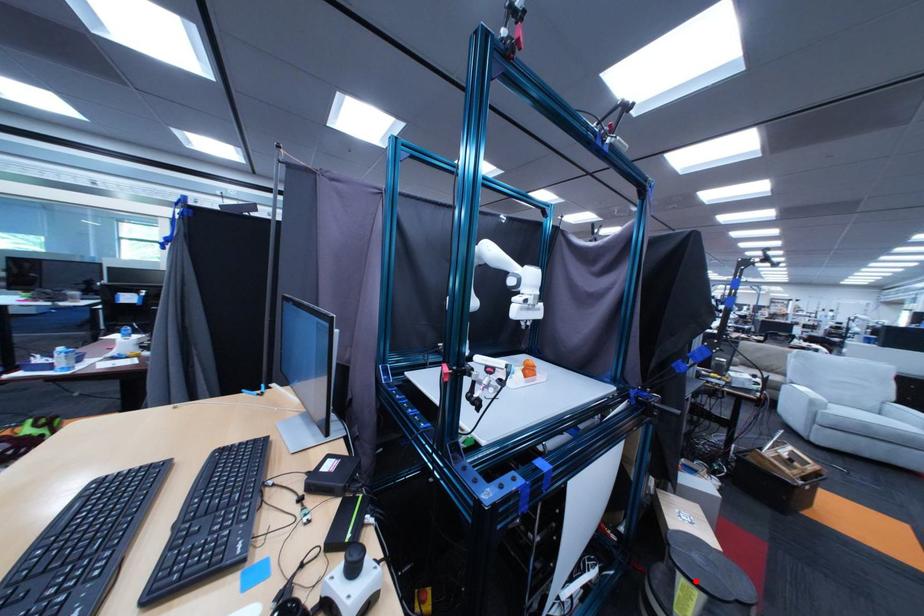
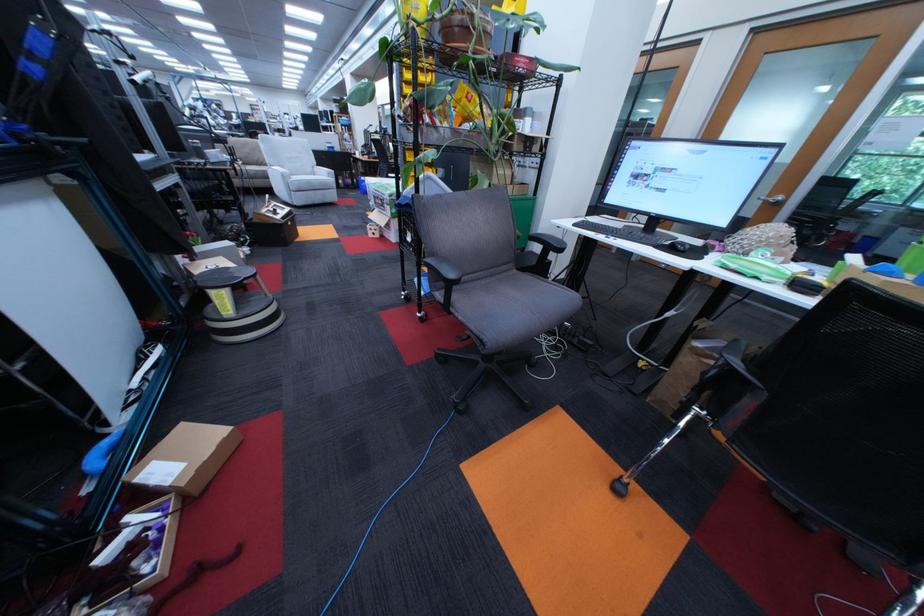
The point at the highlighted location is marked in the first image. Where is the corresponding point in the second image?

(225, 294)